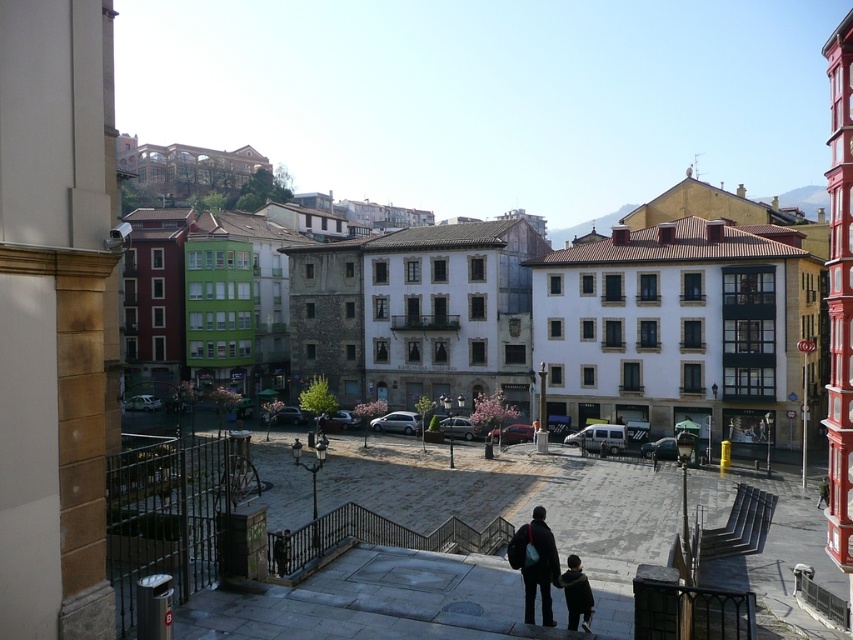
You are standing on the balcony and want to locate the dark blue jacket at lower center. Which direction should you look to see it relative to the white stone building at center?

To locate the dark blue jacket at lower center, you should look to the left of the white stone building at center since the white stone building at center is to the right of the dark blue jacket at lower center.

You are standing on the balcony and want to place your dark blue backpack at lower center next to the white stone building at center. Can you estimate if the backpack will fit next to the building in the square?

The white stone building at center might be wider than dark blue backpack at lower center, so there might be enough space for the backpack next to the building.

You are standing on a balcony overlooking the square. You see the white stone building at center and the dark blue jacket at lower center. Which object is taller?

The white stone building at center is taller than the dark blue jacket at lower center.